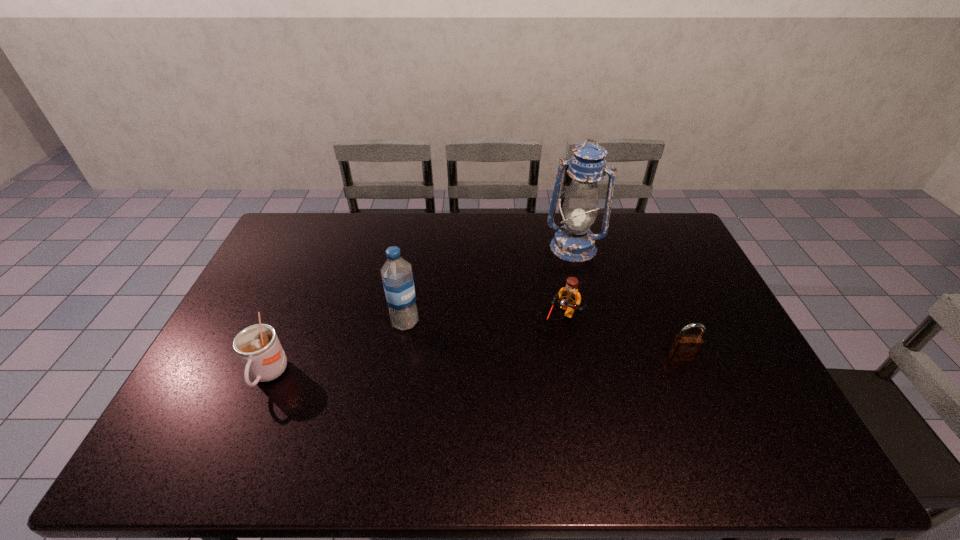
Locate an element on the screen. This screenshot has width=960, height=540. vacant space on the desktop that is between the leftmost object and the padlock and is positioned on the label of the second object from left to right is located at coordinates (448, 367).

Image resolution: width=960 pixels, height=540 pixels. Identify the location of free spot on the desktop that is between the third shortest object and the padlock and is positioned on the front-facing side of the lantern. (524, 364).

Locate an element on the screen. vacant space on the desktop that is between the third tallest object and the rightmost object and is positioned holding a crossbow in the hands of the Lego is located at coordinates (535, 363).